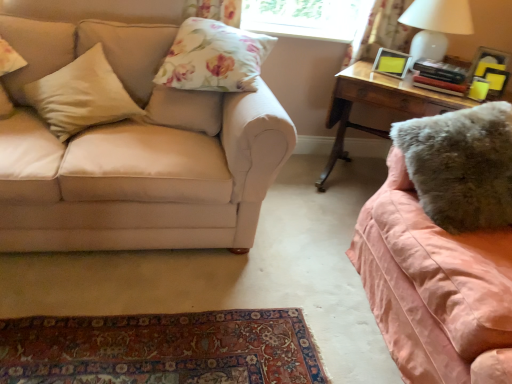
Question: Considering the relative positions of floral fabric curtain at upper right and beige fabric pillow at left, which appears as the 2th pillow when viewed from the left, in the image provided, is floral fabric curtain at upper right to the left of beige fabric pillow at left, which appears as the 2th pillow when viewed from the left, from the viewer's perspective?

Choices:
 (A) no
 (B) yes

Answer: (A)

Question: Does floral fabric curtain at upper right have a greater width compared to beige fabric pillow at left, the 3th pillow from the right?

Choices:
 (A) yes
 (B) no

Answer: (B)

Question: Would you say beige fabric pillow at left, which appears as the 2th pillow when viewed from the left, is part of floral fabric curtain at upper right's contents?

Choices:
 (A) no
 (B) yes

Answer: (A)

Question: Is the depth of floral fabric curtain at upper right less than that of beige fabric pillow at left, the 3th pillow from the right?

Choices:
 (A) yes
 (B) no

Answer: (B)

Question: Is the depth of floral fabric curtain at upper right greater than that of beige fabric pillow at left, which appears as the 2th pillow when viewed from the left?

Choices:
 (A) yes
 (B) no

Answer: (A)

Question: Is floral fabric curtain at upper right bigger than beige fabric pillow at left, the 3th pillow from the right?

Choices:
 (A) yes
 (B) no

Answer: (B)

Question: Is fuzzy pink blanket at right, the 2th studio couch positioned from the left, positioned with its back to beige fabric pillow at left, positioned as the first pillow in left-to-right order?

Choices:
 (A) yes
 (B) no

Answer: (B)

Question: Does fuzzy pink blanket at right, which is the first studio couch from right to left, have a lesser height compared to beige fabric pillow at left, marked as the fourth pillow in a right-to-left arrangement?

Choices:
 (A) yes
 (B) no

Answer: (B)

Question: Can you confirm if fuzzy pink blanket at right, which is the first studio couch from right to left, is smaller than beige fabric pillow at left, positioned as the first pillow in left-to-right order?

Choices:
 (A) yes
 (B) no

Answer: (B)

Question: Is fuzzy pink blanket at right, which is the first studio couch from right to left, not close to beige fabric pillow at left, marked as the fourth pillow in a right-to-left arrangement?

Choices:
 (A) no
 (B) yes

Answer: (B)

Question: From a real-world perspective, is fuzzy pink blanket at right, the 2th studio couch positioned from the left, physically below beige fabric pillow at left, marked as the fourth pillow in a right-to-left arrangement?

Choices:
 (A) no
 (B) yes

Answer: (B)

Question: Is fuzzy pink blanket at right, which is the first studio couch from right to left, positioned behind beige fabric pillow at left, positioned as the first pillow in left-to-right order?

Choices:
 (A) yes
 (B) no

Answer: (B)

Question: From a real-world perspective, is fuzzy gray pillow at right, the first pillow positioned from the right, positioned over beige fabric pillow at left, positioned as the first pillow in left-to-right order, based on gravity?

Choices:
 (A) no
 (B) yes

Answer: (B)